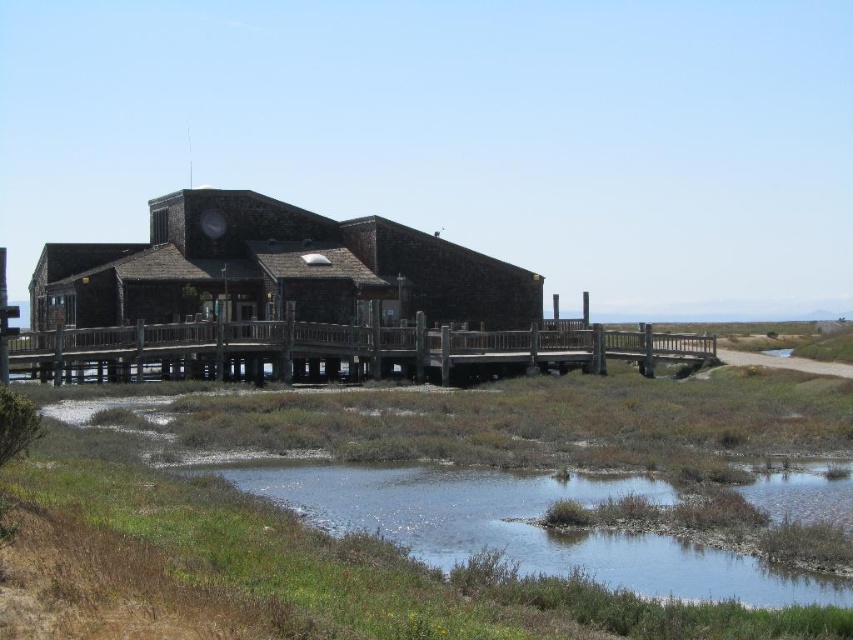
Is brown wood hut at center wider than clear water at lower center?

Correct, the width of brown wood hut at center exceeds that of clear water at lower center.

Between point (316, 225) and point (299, 502), which one is positioned in front?

Point (299, 502) is in front.

Is point (213, 292) positioned in front of point (544, 566)?

No, (213, 292) is behind (544, 566).

You are a GUI agent. You are given a task and a screenshot of the screen. Output one action in this format:
    pyautogui.click(x=<x>, y=<y>)
    Task: Click on the brown wood hut at center
    Image resolution: width=853 pixels, height=640 pixels.
    Given the screenshot: What is the action you would take?
    pyautogui.click(x=274, y=272)